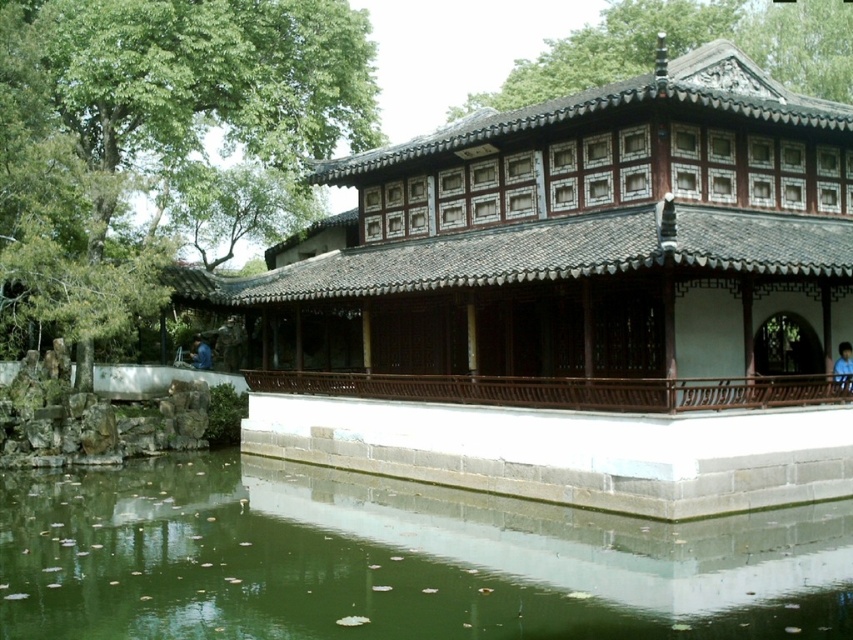
Does brown wooden palace at center appear over green water at lower left?

Yes, brown wooden palace at center is above green water at lower left.

Can you confirm if brown wooden palace at center is wider than green water at lower left?

Correct, the width of brown wooden palace at center exceeds that of green water at lower left.

This screenshot has height=640, width=853. Identify the location of brown wooden palace at center. (x=585, y=298).